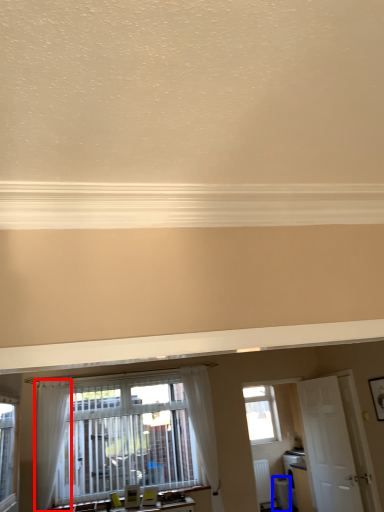
Question: Which of the following is the closest to the observer, curtain (highlighted by a red box) or appliance (highlighted by a blue box)?

Choices:
 (A) curtain
 (B) appliance

Answer: (A)